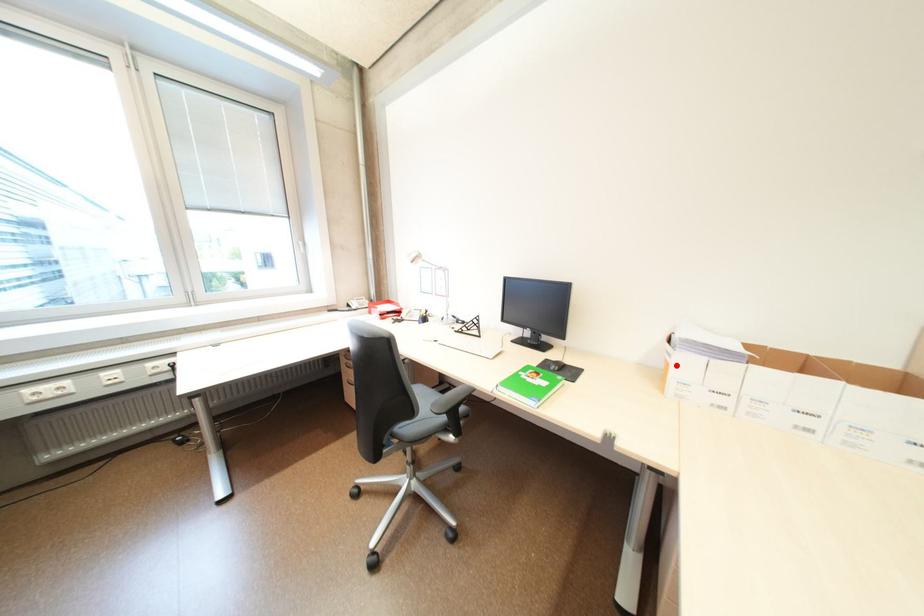
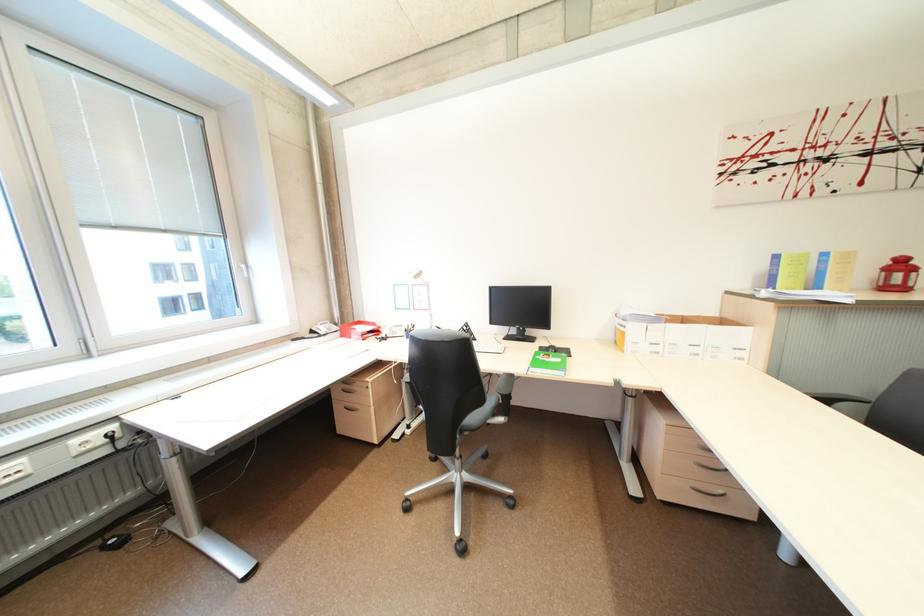
Where in the second image is the point corresponding to the highlighted location from the first image?

(633, 334)